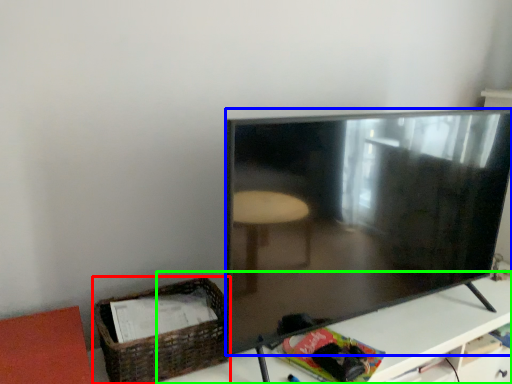
Question: Which object is positioned farthest from basket (highlighted by a red box)? Select from television (highlighted by a blue box) and table (highlighted by a green box).

Choices:
 (A) television
 (B) table

Answer: (B)